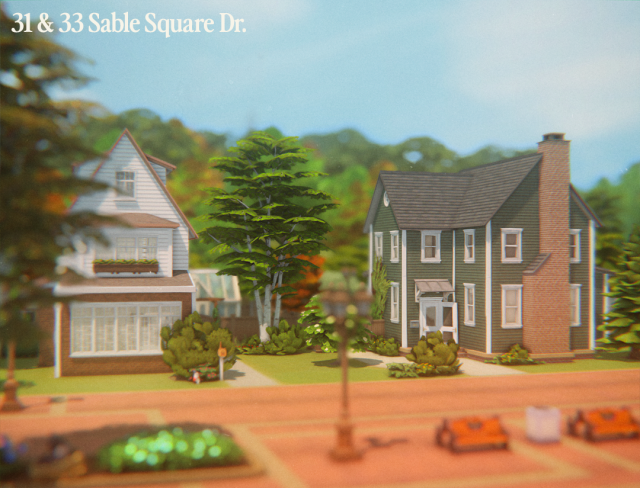
Where is `upstairs windows`? The height and width of the screenshot is (488, 640). upstairs windows is located at coordinates (509, 249), (573, 246), (468, 244), (435, 244), (393, 244), (381, 244), (123, 179), (93, 252), (120, 251), (145, 246).